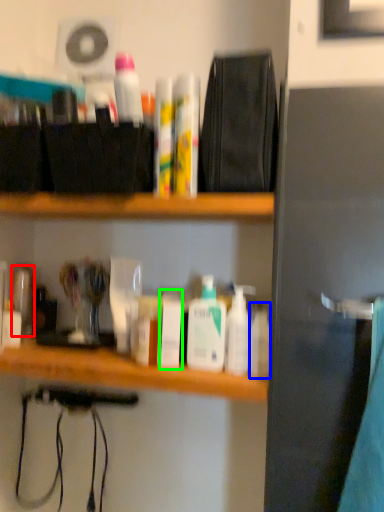
Question: Based on their relative distances, which object is farther from toiletry (highlighted by a red box)? Choose from toiletry (highlighted by a blue box) and toiletry (highlighted by a green box).

Choices:
 (A) toiletry
 (B) toiletry

Answer: (A)